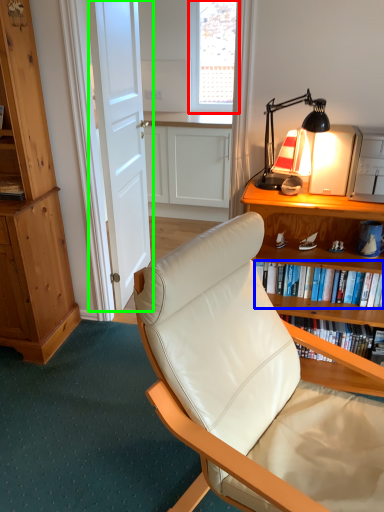
Question: Which object is positioned closest to window screen (highlighted by a red box)? Select from book (highlighted by a blue box) and door (highlighted by a green box).

Choices:
 (A) book
 (B) door

Answer: (B)